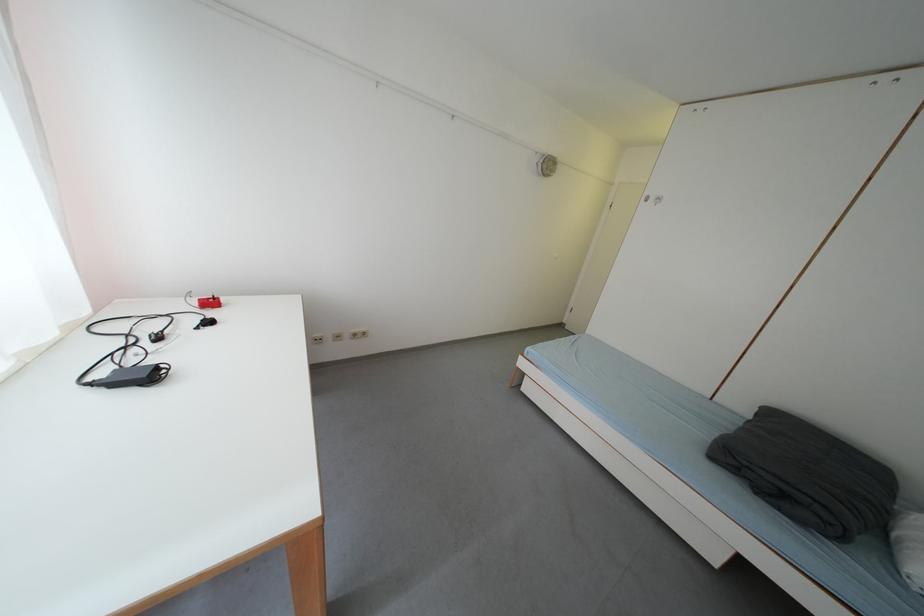
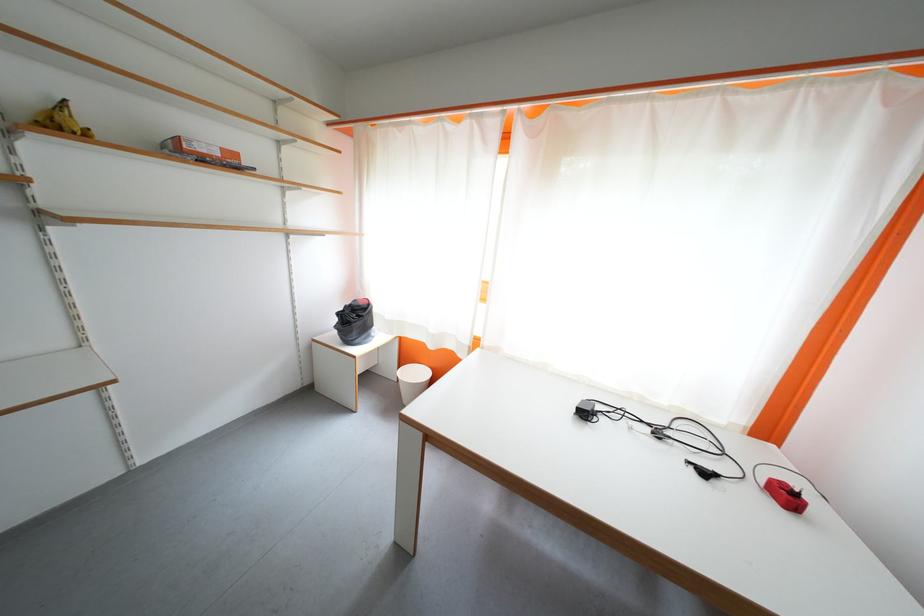
In the second image, find the point that corresponds to [219,326] in the first image.

(713, 477)